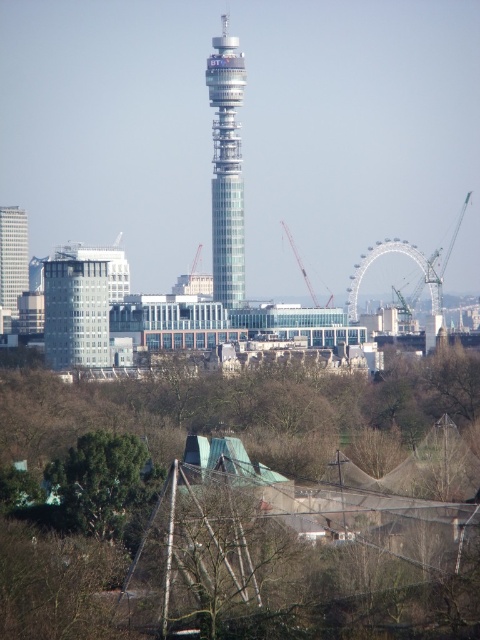
Question: Can you confirm if green leafy tree at lower left is positioned below glassy white skyscraper at left?

Choices:
 (A) no
 (B) yes

Answer: (B)

Question: Which of the following is the farthest from the observer?

Choices:
 (A) (4, 520)
 (B) (226, 26)
 (C) (470, 193)
 (D) (303, 276)

Answer: (C)

Question: Is the position of glassy metallic tower at center more distant than that of metallic gray crane at right?

Choices:
 (A) no
 (B) yes

Answer: (A)

Question: Does metallic wire mesh at center come behind metallic gray crane at center?

Choices:
 (A) yes
 (B) no

Answer: (B)

Question: Estimate the real-world distances between objects in this image. Which object is farther from the glassy metallic tower at center?

Choices:
 (A) metallic wire mesh at center
 (B) glassy white skyscraper at left
 (C) metallic gray crane at center

Answer: (B)

Question: Which object appears farthest from the camera in this image?

Choices:
 (A) metallic wire mesh at center
 (B) glassy metallic tower at center

Answer: (A)